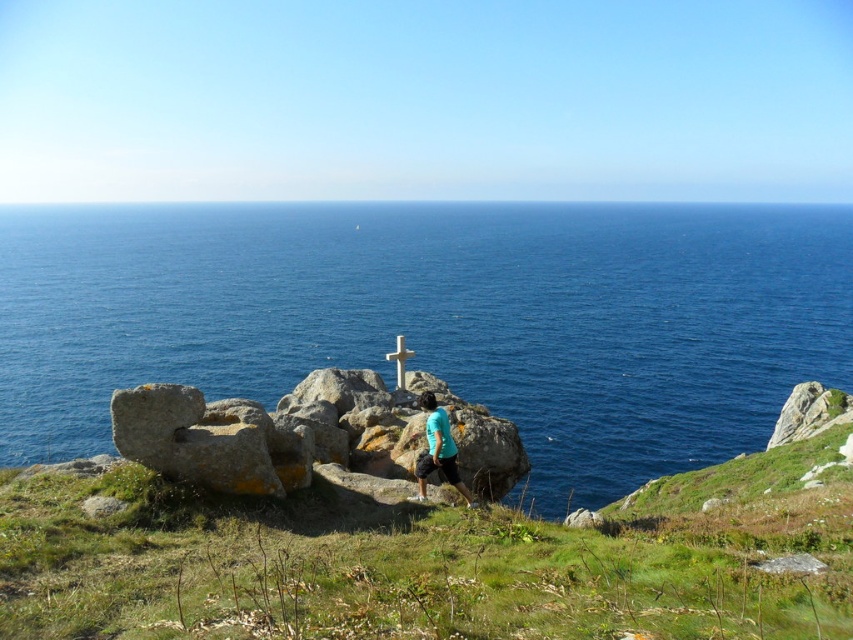
Is blue water at center to the left of rusty stone bench at center from the viewer's perspective?

In fact, blue water at center is to the right of rusty stone bench at center.

Can you confirm if blue water at center is bigger than rusty stone bench at center?

Yes, blue water at center is bigger than rusty stone bench at center.

Which is behind, point (91, 241) or point (448, 404)?

Point (91, 241)

At what (x,y) coordinates should I click in order to perform the action: click on blue water at center. Please return your answer as a coordinate pair (x, y). Looking at the image, I should click on (436, 317).

Which of these two, rusty stone bench at center or white stone cross at center, stands taller?

With more height is rusty stone bench at center.

Which is below, rusty stone bench at center or white stone cross at center?

Positioned lower is rusty stone bench at center.

At what (x,y) coordinates should I click in order to perform the action: click on rusty stone bench at center. Please return your answer as a coordinate pair (x, y). The height and width of the screenshot is (640, 853). Looking at the image, I should click on 262,432.

Which of these two, blue matte shirt at center or white stone cross at center, stands taller?

With more height is white stone cross at center.

Which is in front, point (421, 472) or point (402, 365)?

Positioned in front is point (421, 472).

The width and height of the screenshot is (853, 640). Identify the location of blue matte shirt at center. (437, 451).